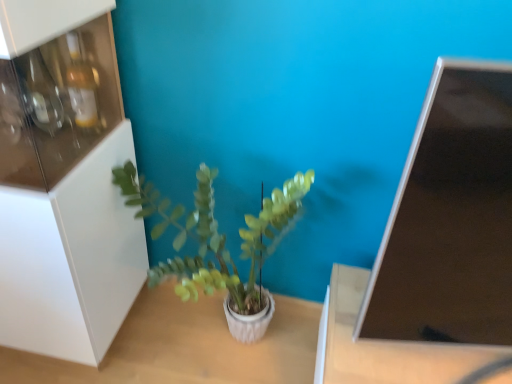
I want to click on free space underneath matte black monitor at upper right (from a real-world perspective), so click(x=429, y=369).